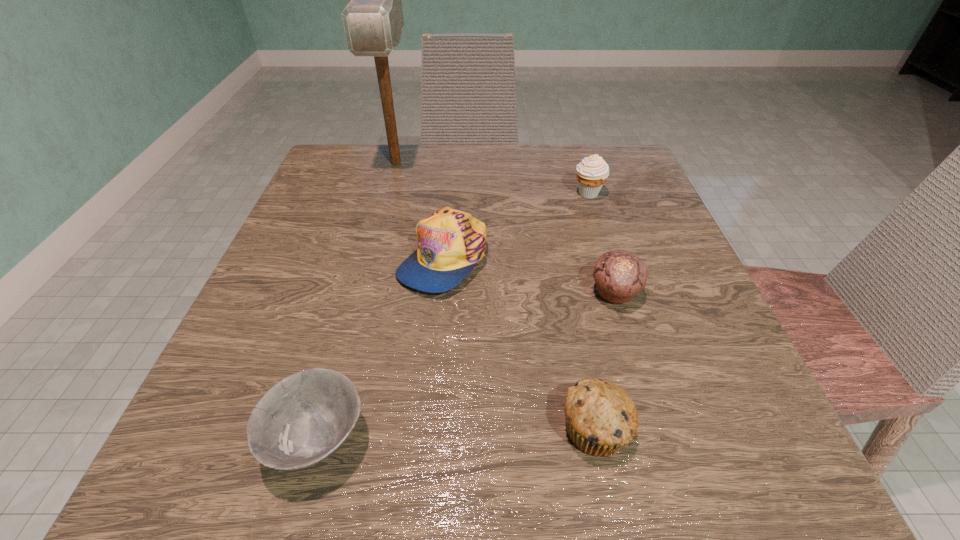
Where is `object that is at the far left corner`? This screenshot has height=540, width=960. object that is at the far left corner is located at coordinates (373, 20).

Find the location of `object located in the near left corner section of the desktop`. object located in the near left corner section of the desktop is located at coordinates (303, 419).

Image resolution: width=960 pixels, height=540 pixels. I want to click on object positioned at the far right corner, so [592, 172].

Find the location of a particular element. This screenshot has width=960, height=540. free region at the far edge of the desktop is located at coordinates (557, 197).

Image resolution: width=960 pixels, height=540 pixels. Find the location of `free location at the left edge of the desktop`. free location at the left edge of the desktop is located at coordinates (206, 383).

You are a GUI agent. You are given a task and a screenshot of the screen. Output one action in this format:
    pyautogui.click(x=<x>, y=<y>)
    Task: Click on the vacant region at the right edge of the desktop
    Image resolution: width=960 pixels, height=540 pixels.
    Given the screenshot: What is the action you would take?
    pyautogui.click(x=593, y=249)

This screenshot has width=960, height=540. I want to click on vacant space at the far left corner of the desktop, so click(x=381, y=196).

This screenshot has height=540, width=960. I want to click on vacant space at the near left corner of the desktop, so click(164, 475).

In the image, there is a desktop. Identify the location of vacant region at the far right corner. (573, 160).

In order to click on free area in between the tallest muffin and the mallet in this screenshot , I will do `click(492, 178)`.